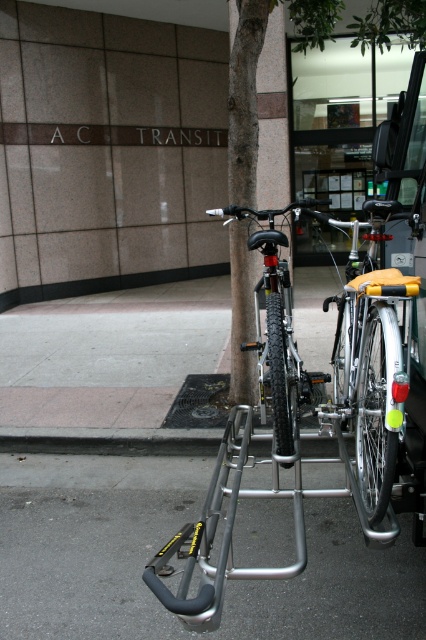
Based on the photo, can you confirm if metallic gray pavement at lower center is positioned below matte black bicycle at center?

Indeed, metallic gray pavement at lower center is positioned under matte black bicycle at center.

Who is more distant from viewer, (85, 563) or (307, 209)?

The point (307, 209) is more distant.

The image size is (426, 640). What are the coordinates of `metallic gray pavement at lower center` in the screenshot? It's located at (226, 588).

Between point (339, 356) and point (290, 397), which one is positioned behind?

The point (339, 356) is more distant.

I want to click on matte black bicycle at center, so click(370, 365).

Where is `matte black bicycle at center`? matte black bicycle at center is located at coordinates (370, 365).

Can you confirm if metallic gray pavement at lower center is shorter than shiny black bike at center?

Yes, metallic gray pavement at lower center is shorter than shiny black bike at center.

In the scene shown: Does metallic gray pavement at lower center appear under shiny black bike at center?

Yes, metallic gray pavement at lower center is below shiny black bike at center.

Between point (414, 636) and point (284, 288), which one is positioned in front?

Positioned in front is point (414, 636).

The image size is (426, 640). Find the location of `metallic gray pavement at lower center`. metallic gray pavement at lower center is located at coordinates (226, 588).